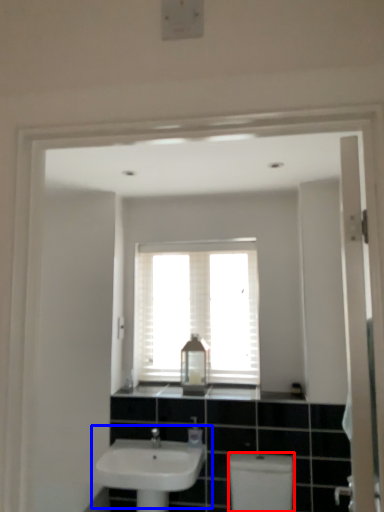
Question: Which object appears closest to the camera in this image, toilet bowl (highlighted by a red box) or sink (highlighted by a blue box)?

Choices:
 (A) toilet bowl
 (B) sink

Answer: (A)